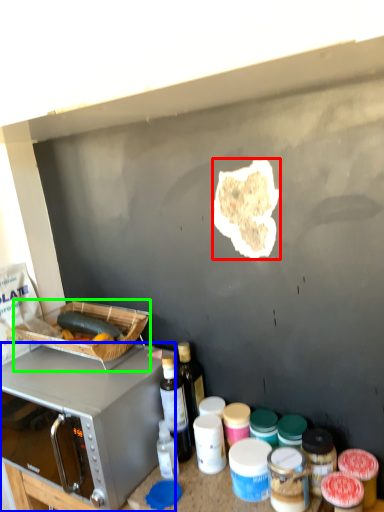
Question: Based on their relative distances, which object is nearer to food (highlighted by a red box)? Choose from microwave oven (highlighted by a blue box) and appliance (highlighted by a green box).

Choices:
 (A) microwave oven
 (B) appliance

Answer: (B)